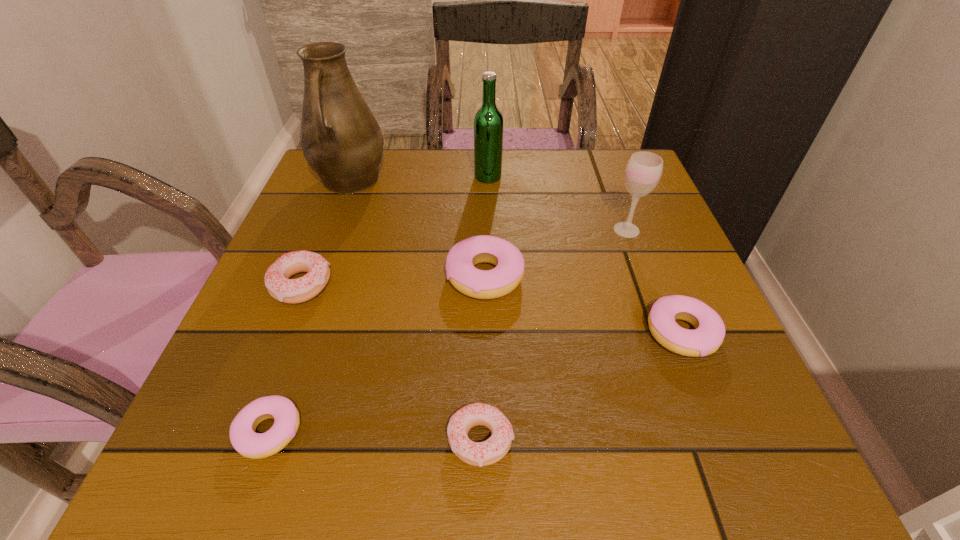
Find the location of a particular element. This screenshot has width=960, height=540. free region at the far edge is located at coordinates 423,151.

You are a GUI agent. You are given a task and a screenshot of the screen. Output one action in this format:
    pyautogui.click(x=<x>, y=<y>)
    Task: Click on the vacant space at the near edge
    
    Given the screenshot: What is the action you would take?
    (x=441, y=443)

In the image, there is a desktop. In order to click on free space at the left edge in this screenshot , I will do `click(234, 362)`.

You are a GUI agent. You are given a task and a screenshot of the screen. Output one action in this format:
    pyautogui.click(x=<x>, y=<y>)
    Task: Click on the vacant space at the right edge
    Image resolution: width=960 pixels, height=540 pixels.
    Given the screenshot: What is the action you would take?
    pyautogui.click(x=660, y=211)

Find the location of `free location at the far right corner of the desktop`. free location at the far right corner of the desktop is located at coordinates (623, 155).

In the image, there is a desktop. At what (x,y) coordinates should I click in order to perform the action: click on free space at the near right corner. Please return your answer as a coordinate pair (x, y). Looking at the image, I should click on (724, 476).

Identify the location of vacant area that lies between the left white doughnut and the smaller white doughnut. (391, 363).

The height and width of the screenshot is (540, 960). Find the location of `unoccupied position between the second biggest pink doughnut and the third farthest object`. unoccupied position between the second biggest pink doughnut and the third farthest object is located at coordinates (654, 281).

This screenshot has width=960, height=540. What are the coordinates of `vacant space that's between the tallest object and the bigger white doughnut` in the screenshot? It's located at (325, 233).

You are a GUI agent. You are given a task and a screenshot of the screen. Output one action in this format:
    pyautogui.click(x=<x>, y=<y>)
    Task: Click on the unoccupied position between the tallest object and the left white doughnut
    The height and width of the screenshot is (540, 960).
    Given the screenshot: What is the action you would take?
    pyautogui.click(x=325, y=233)